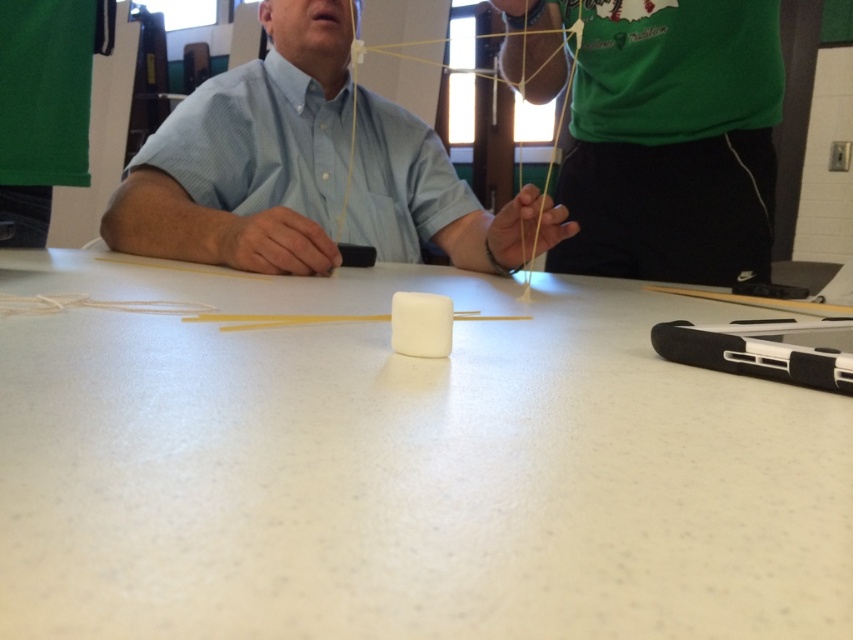
Can you confirm if white matte table at center is wider than matte blue shirt at center?

Indeed, white matte table at center has a greater width compared to matte blue shirt at center.

Can you confirm if white matte table at center is bigger than matte blue shirt at center?

No, white matte table at center is not bigger than matte blue shirt at center.

Does point (107, 362) come behind point (328, 61)?

No, (107, 362) is closer to viewer.

Locate an element on the screen. This screenshot has width=853, height=640. white matte table at center is located at coordinates (402, 467).

Is the position of white matte table at center more distant than that of green matte shirt at upper center?

That is False.

Which of these two, white matte table at center or green matte shirt at upper center, stands taller?

With more height is green matte shirt at upper center.

Is point (229, 509) positioned after point (664, 184)?

No, it is not.

Image resolution: width=853 pixels, height=640 pixels. Identify the location of white matte table at center. (402, 467).

Who is more distant from viewer, (222, 189) or (608, 109)?

The point (608, 109) is more distant.

Does point (119, 221) come closer to viewer compared to point (672, 68)?

No.

Image resolution: width=853 pixels, height=640 pixels. What are the coordinates of `matte blue shirt at center` in the screenshot? It's located at (248, 156).